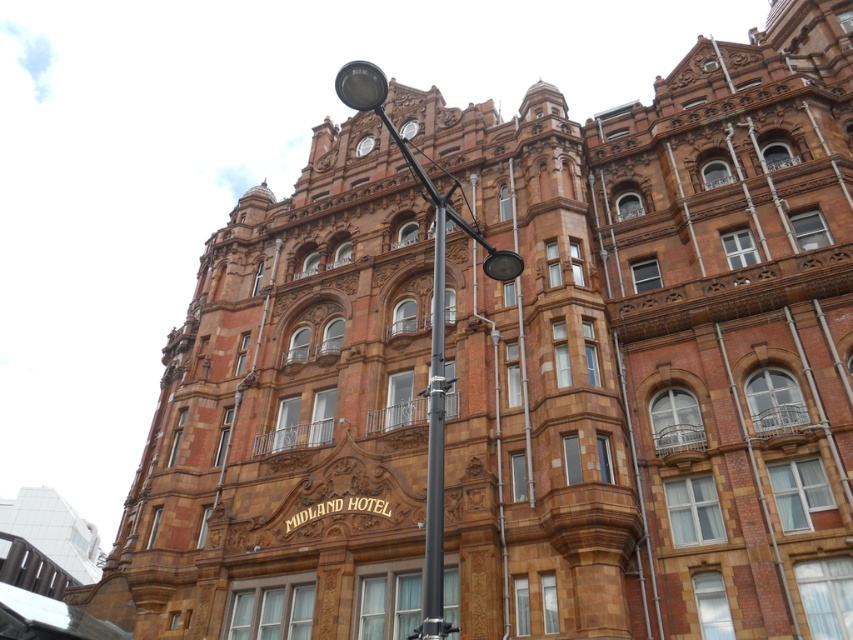
Question: Considering the relative positions of black metal lamp post at center and metallic gray pole at center in the image provided, where is black metal lamp post at center located with respect to metallic gray pole at center?

Choices:
 (A) left
 (B) right

Answer: (A)

Question: Among these points, which one is farthest from the camera?

Choices:
 (A) (438, 342)
 (B) (436, 419)

Answer: (A)

Question: Among these objects, which one is nearest to the camera?

Choices:
 (A) black metal lamp post at center
 (B) metallic gray pole at center

Answer: (B)

Question: Does black metal lamp post at center have a smaller size compared to metallic gray pole at center?

Choices:
 (A) yes
 (B) no

Answer: (B)

Question: Is black metal lamp post at center to the right of metallic gray pole at center from the viewer's perspective?

Choices:
 (A) no
 (B) yes

Answer: (A)

Question: Which object is farther from the camera taking this photo?

Choices:
 (A) metallic gray pole at center
 (B) black metal lamp post at center

Answer: (B)